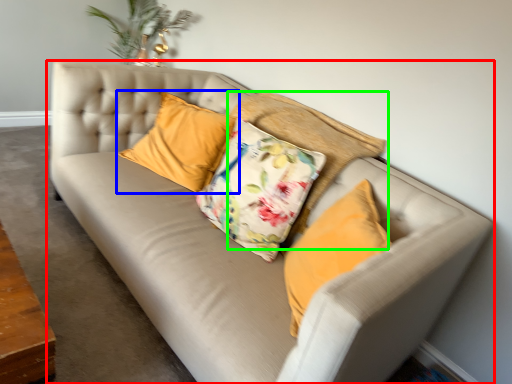
Question: Which object is the closest to the studio couch (highlighted by a red box)? Choose among these: pillow (highlighted by a blue box) or pillow (highlighted by a green box).

Choices:
 (A) pillow
 (B) pillow

Answer: (A)